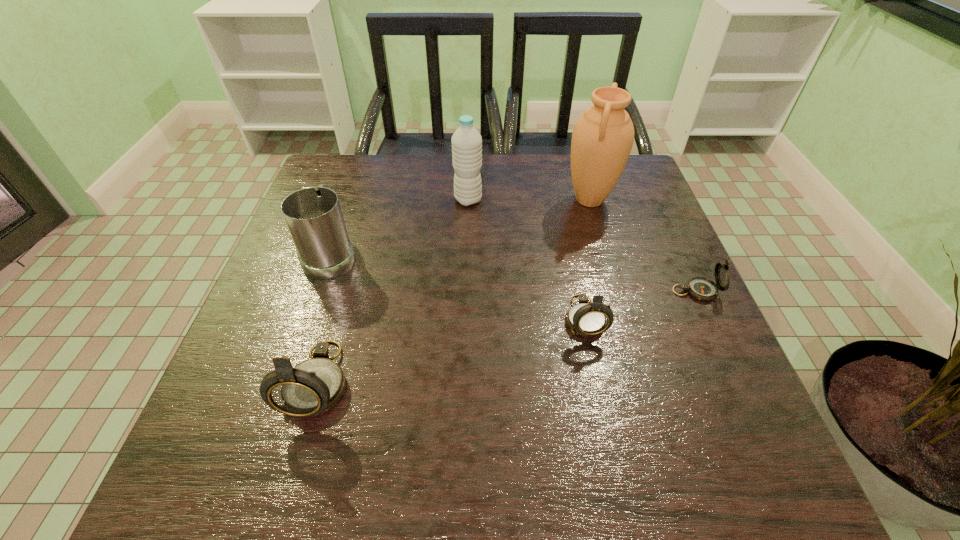
Identify the location of free space between the second shortest compass and the fourth object from right to left. This screenshot has height=540, width=960. coord(526,259).

Choose which object is the fifth nearest neighbor to the tallest compass. Please provide its 2D coordinates. Your answer should be formatted as a tuple, i.e. [(x, y)], where the tuple contains the x and y coordinates of a point satisfying the conditions above.

[(701, 288)]

Point out which object is positioned as the nearest to the fifth shortest object. Please provide its 2D coordinates. Your answer should be formatted as a tuple, i.e. [(x, y)], where the tuple contains the x and y coordinates of a point satisfying the conditions above.

[(602, 139)]

Identify the location of compass that stands as the third closest to the water bottle. The image size is (960, 540). click(x=701, y=288).

Where is `compass that is the closest one to the tallest object`? The width and height of the screenshot is (960, 540). compass that is the closest one to the tallest object is located at coordinates (701, 288).

Where is `free space in the image that satisfies the following two spatial constraints: 1. on the side of the mug with the handle; 2. on the left side of the urn`? The height and width of the screenshot is (540, 960). free space in the image that satisfies the following two spatial constraints: 1. on the side of the mug with the handle; 2. on the left side of the urn is located at coordinates (350, 200).

At what (x,y) coordinates should I click in order to perform the action: click on vacant space that satisfies the following two spatial constraints: 1. on the side of the urn with the handle; 2. on the left side of the fourth nearest object. Please return your answer as a coordinate pair (x, y). This screenshot has height=540, width=960. Looking at the image, I should click on (350, 200).

Where is `free space that satisfies the following two spatial constraints: 1. on the face of the rightmost compass; 2. on the face of the tallest compass`? The image size is (960, 540). free space that satisfies the following two spatial constraints: 1. on the face of the rightmost compass; 2. on the face of the tallest compass is located at coordinates (736, 381).

Locate an element on the screen. vacant space that satisfies the following two spatial constraints: 1. on the face of the shortest compass; 2. on the face of the tallest compass is located at coordinates (736, 381).